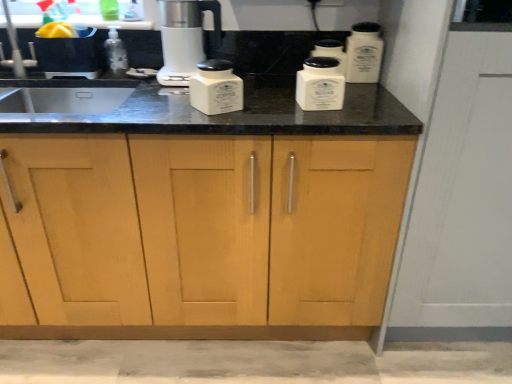
From a real-world perspective, can you point to a free location above satin white coffee maker at center? Please provide its 2D coordinates.

[(0.360, -0.001)]